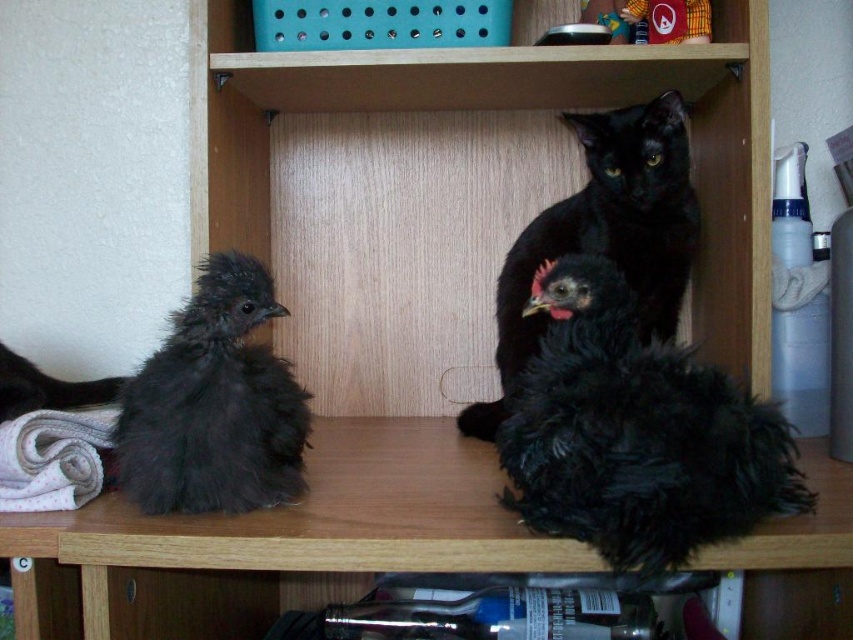
Who is more forward, (299,496) or (622,132)?

Point (299,496) is in front.

Is dark fluffy chicken at left behind black fluffy cat at upper center?

That is False.

Measure the distance between point (207, 396) and camera.

The distance of point (207, 396) from camera is 29.20 inches.

At what (x,y) coordinates should I click in order to perform the action: click on dark fluffy chicken at left. Please return your answer as a coordinate pair (x, y). Image resolution: width=853 pixels, height=640 pixels. Looking at the image, I should click on (213, 404).

Between black fluffy chicken at center and dark fluffy chicken at left, which one appears on the left side from the viewer's perspective?

From the viewer's perspective, dark fluffy chicken at left appears more on the left side.

Can you confirm if black fluffy chicken at center is positioned above dark fluffy chicken at left?

No, black fluffy chicken at center is not above dark fluffy chicken at left.

Is point (682, 516) closer to viewer compared to point (195, 307)?

Yes, it is in front of point (195, 307).

The width and height of the screenshot is (853, 640). What are the coordinates of `black fluffy chicken at center` in the screenshot? It's located at (635, 433).

Is dark fluffy chicken at left to the left of smooth yellow fabric at upper center from the viewer's perspective?

Correct, you'll find dark fluffy chicken at left to the left of smooth yellow fabric at upper center.

Measure the distance between dark fluffy chicken at left and camera.

72.91 centimeters

This screenshot has height=640, width=853. What are the coordinates of `dark fluffy chicken at left` in the screenshot? It's located at (213, 404).